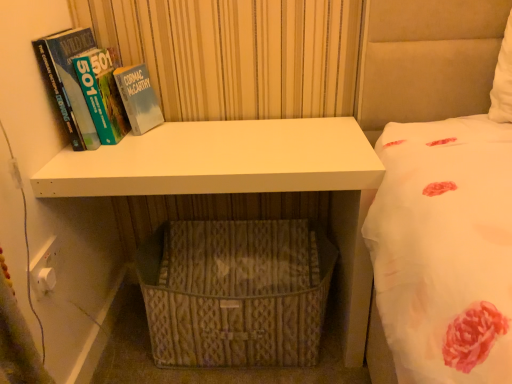
Question: Is hardcover book at left touching woven beige basket at lower center?

Choices:
 (A) yes
 (B) no

Answer: (B)

Question: Does hardcover book at left lie behind woven beige basket at lower center?

Choices:
 (A) yes
 (B) no

Answer: (B)

Question: Is hardcover book at left taller than woven beige basket at lower center?

Choices:
 (A) no
 (B) yes

Answer: (B)

Question: Is hardcover book at left to the right of woven beige basket at lower center from the viewer's perspective?

Choices:
 (A) no
 (B) yes

Answer: (A)

Question: Considering the relative positions of hardcover book at left and woven beige basket at lower center in the image provided, is hardcover book at left to the left of woven beige basket at lower center from the viewer's perspective?

Choices:
 (A) no
 (B) yes

Answer: (B)

Question: Is hardcover book at left positioned beyond the bounds of woven beige basket at lower center?

Choices:
 (A) yes
 (B) no

Answer: (A)

Question: Would you say white matte shelf at center is a long distance from woven beige basket at lower center?

Choices:
 (A) yes
 (B) no

Answer: (B)

Question: Is white matte shelf at center smaller than woven beige basket at lower center?

Choices:
 (A) no
 (B) yes

Answer: (A)

Question: Does white matte shelf at center lie behind woven beige basket at lower center?

Choices:
 (A) no
 (B) yes

Answer: (A)

Question: Is white matte shelf at center turned away from woven beige basket at lower center?

Choices:
 (A) no
 (B) yes

Answer: (B)

Question: Does white matte shelf at center touch woven beige basket at lower center?

Choices:
 (A) yes
 (B) no

Answer: (B)

Question: Can you confirm if white matte shelf at center is thinner than woven beige basket at lower center?

Choices:
 (A) no
 (B) yes

Answer: (B)

Question: Can you confirm if woven beige basket at lower center is shorter than white matte shelf at center?

Choices:
 (A) yes
 (B) no

Answer: (A)